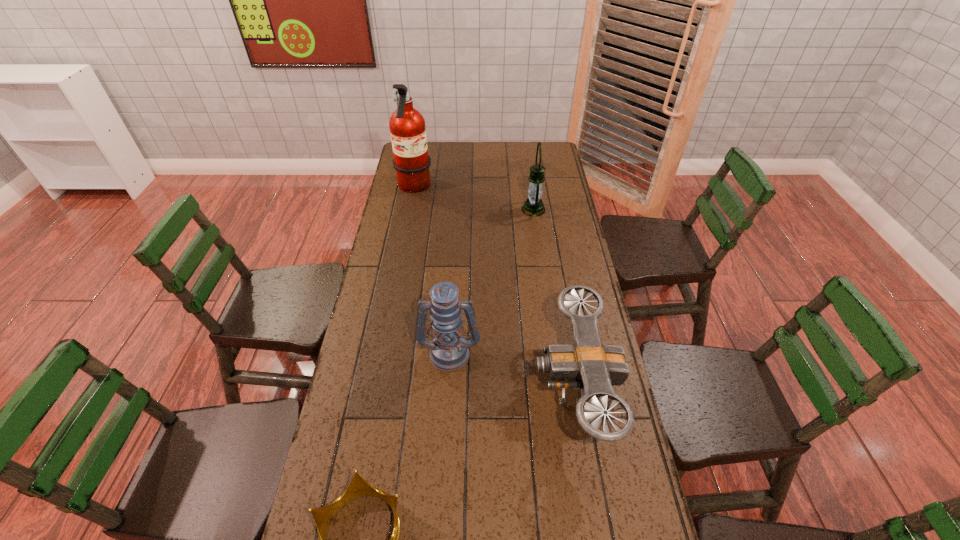
The height and width of the screenshot is (540, 960). I want to click on free region located on the front-facing side of the fourth tallest object, so click(x=440, y=387).

Locate an element on the screen. Image resolution: width=960 pixels, height=540 pixels. vacant space situated on the front-facing side of the fourth tallest object is located at coordinates (402, 387).

Locate an element on the screen. Image resolution: width=960 pixels, height=540 pixels. object that is at the left edge is located at coordinates (407, 126).

Where is `lantern positioned at the right edge`? lantern positioned at the right edge is located at coordinates (533, 206).

Find the location of a particular element. This screenshot has height=540, width=960. drone that is at the right edge is located at coordinates (588, 365).

The width and height of the screenshot is (960, 540). What are the coordinates of `vacant space at the far edge of the desktop` in the screenshot? It's located at [x=467, y=146].

Where is `free space at the left edge of the desktop`? The width and height of the screenshot is (960, 540). free space at the left edge of the desktop is located at coordinates (396, 286).

Image resolution: width=960 pixels, height=540 pixels. In the image, there is a desktop. What are the coordinates of `vacant area at the right edge` in the screenshot? It's located at (598, 491).

The height and width of the screenshot is (540, 960). I want to click on vacant space at the far right corner of the desktop, so click(x=541, y=157).

Where is `vacant space in between the nearer lantern and the fire extinguisher`? The image size is (960, 540). vacant space in between the nearer lantern and the fire extinguisher is located at coordinates (432, 270).